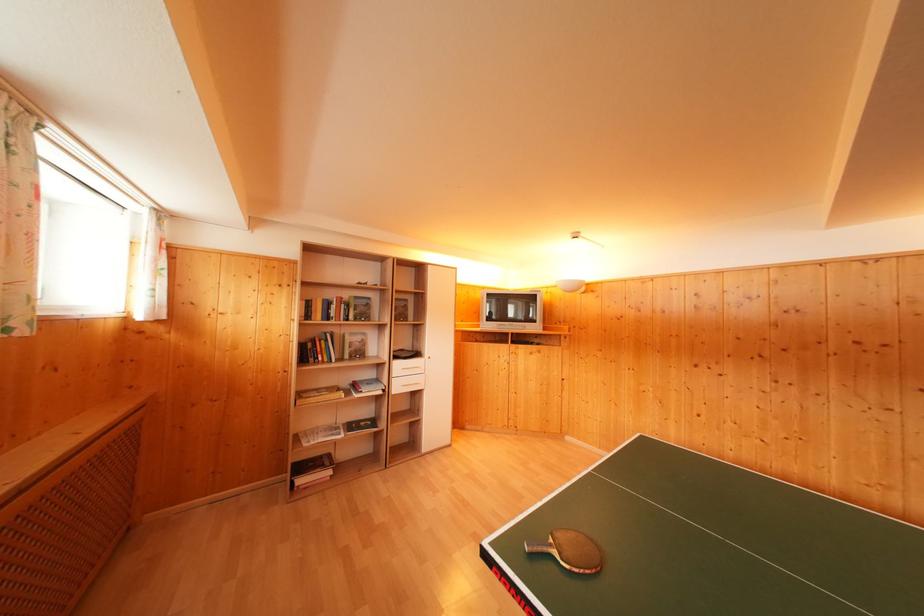
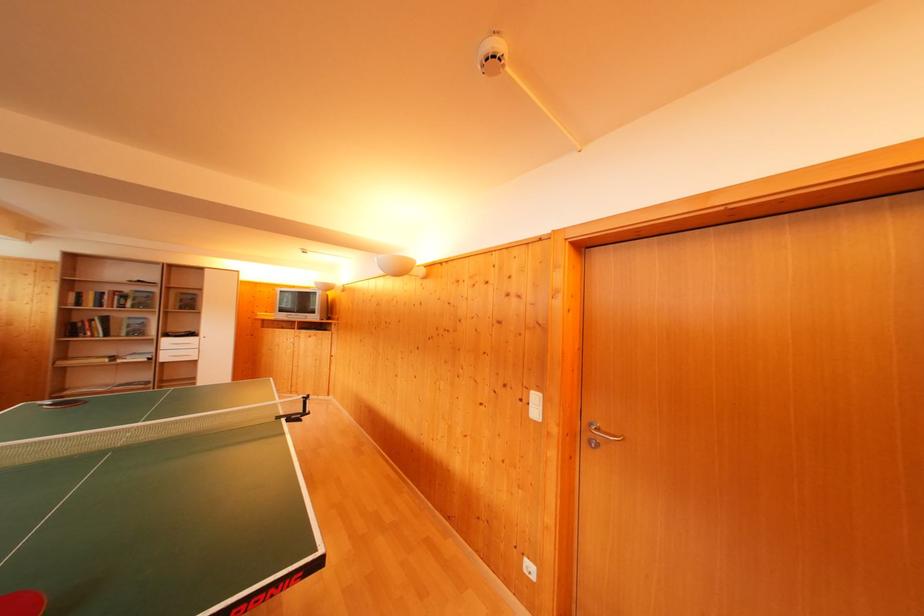
In the second image, find the point that corresponds to pixel 335 300 in the first image.

(112, 294)